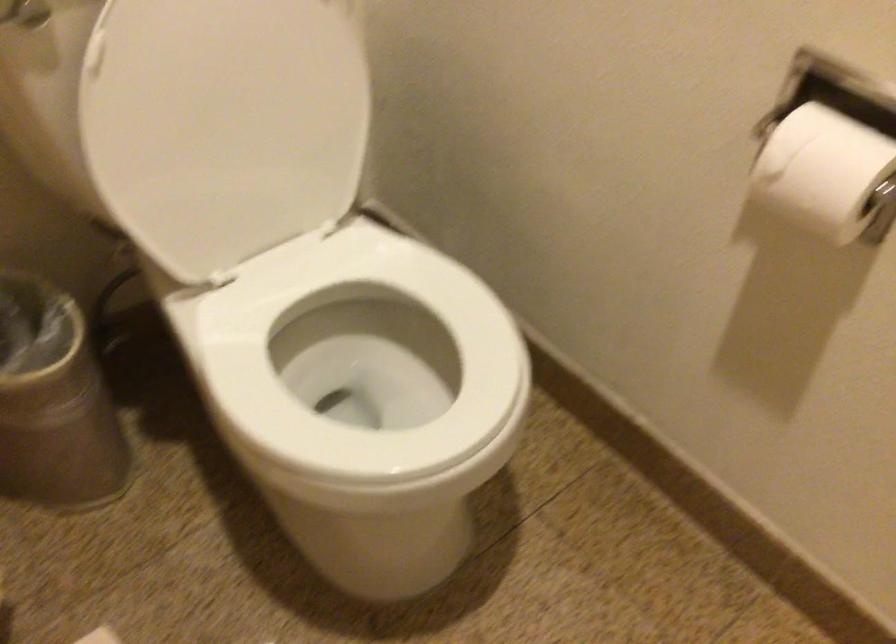
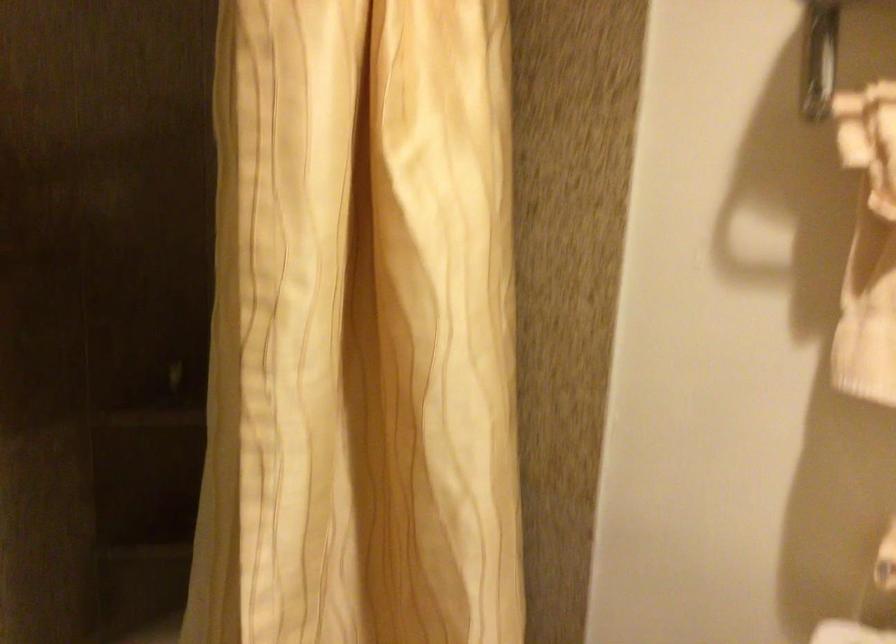
Question: The images are taken continuously from a first-person perspective. In which direction is your viewpoint rotating?

Choices:
 (A) Left
 (B) Right
 (C) Up
 (D) Down

Answer: (A)